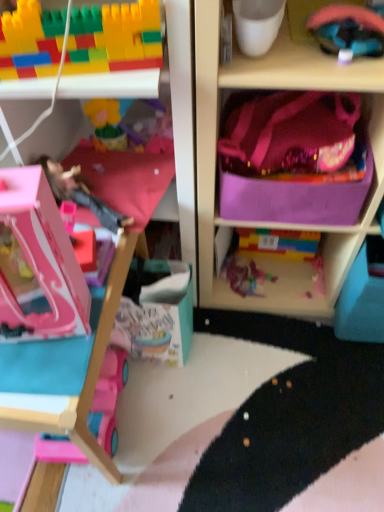
Question: From the image's perspective, is purple fabric bag at upper right on top of rubberized pink helmet at upper right, which is the first toy from top to bottom?

Choices:
 (A) yes
 (B) no

Answer: (B)

Question: From a real-world perspective, does purple fabric bag at upper right stand above rubberized pink helmet at upper right, which is the first toy from top to bottom?

Choices:
 (A) yes
 (B) no

Answer: (B)

Question: From the image's perspective, is purple fabric bag at upper right beneath rubberized pink helmet at upper right, which is the first toy from top to bottom?

Choices:
 (A) yes
 (B) no

Answer: (A)

Question: Does purple fabric bag at upper right have a smaller size compared to rubberized pink helmet at upper right, marked as the 5th toy in a bottom-to-top arrangement?

Choices:
 (A) yes
 (B) no

Answer: (B)

Question: Is purple fabric bag at upper right facing towards rubberized pink helmet at upper right, which is the first toy from top to bottom?

Choices:
 (A) no
 (B) yes

Answer: (B)

Question: Is purple fabric bag at upper right not near rubberized pink helmet at upper right, which is the first toy from top to bottom?

Choices:
 (A) yes
 (B) no

Answer: (B)

Question: Would you say pink plastic dollhouse at left is outside pink plastic dollhouse at left, which appears as the 3th toy when viewed from the top?

Choices:
 (A) yes
 (B) no

Answer: (A)

Question: From a real-world perspective, does pink plastic dollhouse at left sit lower than pink plastic dollhouse at left, which appears as the 3th toy when viewed from the top?

Choices:
 (A) no
 (B) yes

Answer: (B)

Question: From a real-world perspective, does pink plastic dollhouse at left stand above pink plastic dollhouse at left, marked as the 3th toy in a bottom-to-top arrangement?

Choices:
 (A) no
 (B) yes

Answer: (A)

Question: Is pink plastic dollhouse at left to the right of pink plastic dollhouse at left, marked as the 3th toy in a bottom-to-top arrangement, from the viewer's perspective?

Choices:
 (A) no
 (B) yes

Answer: (A)

Question: Can you confirm if pink plastic dollhouse at left is positioned to the left of pink plastic dollhouse at left, which appears as the 3th toy when viewed from the top?

Choices:
 (A) no
 (B) yes

Answer: (B)

Question: Is there a large distance between pink plastic dollhouse at left and pink plastic dollhouse at left, which appears as the 3th toy when viewed from the top?

Choices:
 (A) no
 (B) yes

Answer: (A)

Question: Can you confirm if pink fabric pillow at center is smaller than pink plastic toy car at lower left, the first toy positioned from the bottom?

Choices:
 (A) yes
 (B) no

Answer: (A)